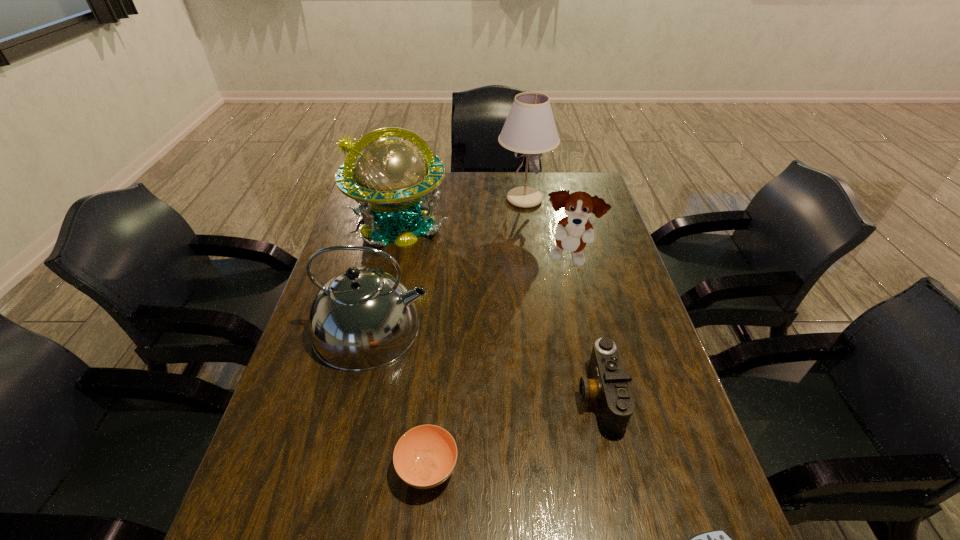
This screenshot has width=960, height=540. Identify the location of vacant area between the puppy and the globe. (483, 241).

Locate an element on the screen. The image size is (960, 540). object that stands as the fourth closest to the kettle is located at coordinates (608, 386).

Identify the location of object that is the fifth closest to the nearest object. (391, 179).

Image resolution: width=960 pixels, height=540 pixels. What are the coordinates of `vacant space that satisfies the following two spatial constraints: 1. on the back side of the lampshade; 2. on the left side of the globe` in the screenshot? It's located at (404, 200).

You are a GUI agent. You are given a task and a screenshot of the screen. Output one action in this format:
    pyautogui.click(x=<x>, y=<y>)
    Task: Click on the vacant space that satisfies the following two spatial constraints: 1. on the face of the puppy; 2. from the spout of the kettle
    The image size is (960, 540).
    Given the screenshot: What is the action you would take?
    pyautogui.click(x=585, y=328)

You are a GUI agent. You are given a task and a screenshot of the screen. Output one action in this format:
    pyautogui.click(x=<x>, y=<y>)
    Task: Click on the free location that satisfies the following two spatial constraints: 1. on the front side of the globe; 2. from the spout of the kettle
    The height and width of the screenshot is (540, 960).
    Given the screenshot: What is the action you would take?
    pyautogui.click(x=373, y=328)

I want to click on vacant region that satisfies the following two spatial constraints: 1. from the spout of the kettle; 2. on the left side of the soup bowl, so pyautogui.click(x=338, y=468).